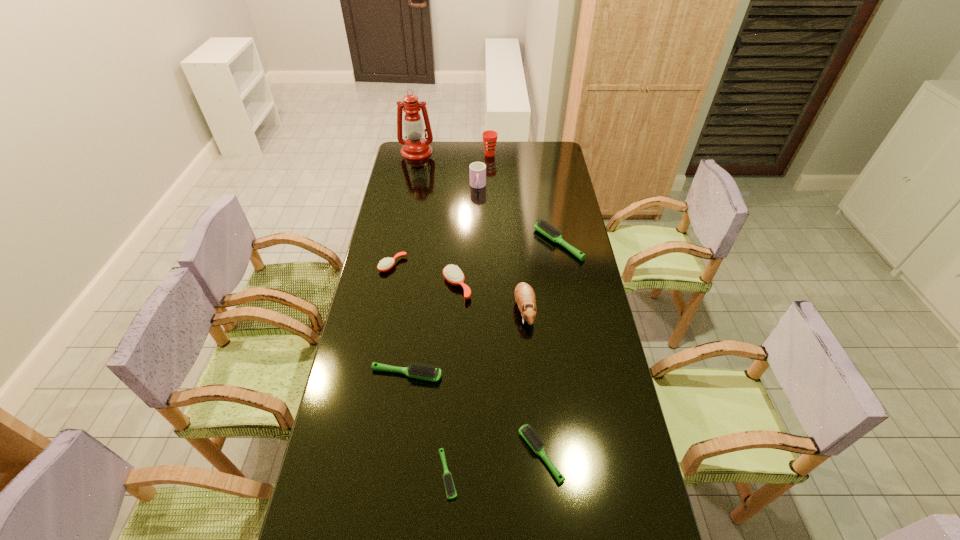
Find the location of a particular element. The width and height of the screenshot is (960, 540). vacant area at the left edge is located at coordinates (380, 228).

The height and width of the screenshot is (540, 960). In the image, there is a desktop. Find the location of `blank space at the right edge`. blank space at the right edge is located at coordinates (577, 275).

This screenshot has height=540, width=960. In the image, there is a desktop. In order to click on vacant space at the far right corner in this screenshot , I will do `click(543, 154)`.

Where is `vacant point located between the brown hamster and the farthest light hairbrush`? vacant point located between the brown hamster and the farthest light hairbrush is located at coordinates (541, 276).

You are a GUI agent. You are given a task and a screenshot of the screen. Output one action in this format:
    pyautogui.click(x=<x>, y=<y>)
    Task: Click on the vacant space in between the tallest object and the left orange hairbrush
    
    Given the screenshot: What is the action you would take?
    pyautogui.click(x=405, y=208)

Identify the location of free space between the right orange hairbrush and the brown hamster. This screenshot has height=540, width=960. (491, 298).

The width and height of the screenshot is (960, 540). Identify the location of vacant space that's between the right orange hairbrush and the rightmost light hairbrush. (508, 265).

The height and width of the screenshot is (540, 960). Find the location of `empty location between the second light hairbrush from right to left and the third light hairbrush from right to left`. empty location between the second light hairbrush from right to left and the third light hairbrush from right to left is located at coordinates (494, 464).

The width and height of the screenshot is (960, 540). I want to click on vacant area that lies between the ninth tallest object and the bigger orange hairbrush, so click(x=499, y=370).

The image size is (960, 540). In order to click on vacant space that is in between the shortest object and the second shortest hairbrush in this screenshot , I will do `click(494, 464)`.